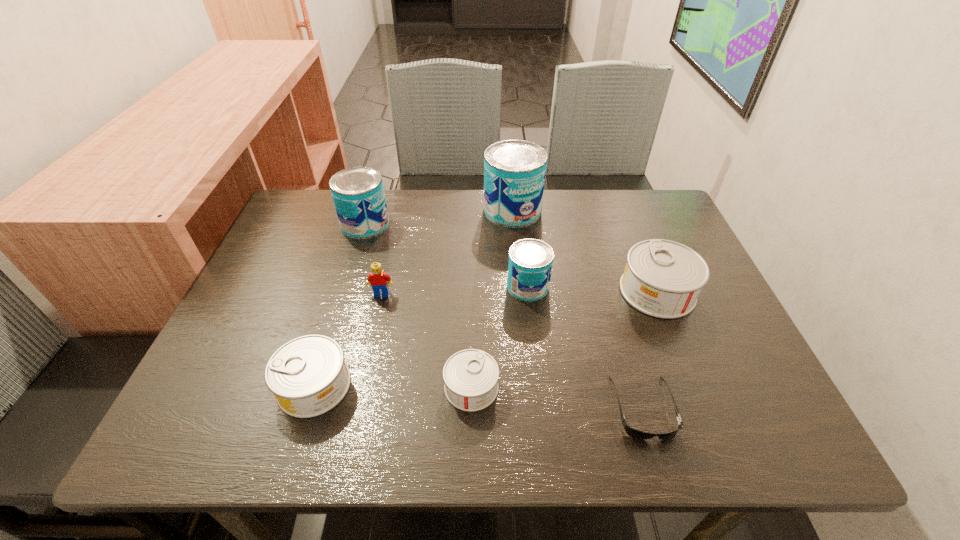
Where is `the tallest can`? The height and width of the screenshot is (540, 960). the tallest can is located at coordinates (514, 170).

This screenshot has height=540, width=960. In order to click on the biggest blue can in this screenshot , I will do `click(514, 170)`.

The width and height of the screenshot is (960, 540). I want to click on the second biggest blue can, so coord(358,194).

The height and width of the screenshot is (540, 960). In order to click on the second tallest object in this screenshot , I will do `click(358, 194)`.

Locate an element on the screen. the nearest blue can is located at coordinates (530, 261).

You are a GUI agent. You are given a task and a screenshot of the screen. Output one action in this format:
    pyautogui.click(x=<x>, y=<y>)
    Task: Click on the red Lego
    Image resolution: width=960 pixels, height=540 pixels.
    Given the screenshot: What is the action you would take?
    pyautogui.click(x=379, y=280)

Where is `the biggest silver can`? the biggest silver can is located at coordinates (663, 279).

Locate an element on the screen. The width and height of the screenshot is (960, 540). the farthest silver can is located at coordinates (663, 279).

Where is `the second shortest can`? Image resolution: width=960 pixels, height=540 pixels. the second shortest can is located at coordinates (308, 376).

At what (x,y) coordinates should I click in order to perform the action: click on the third shortest object. Please return your answer as a coordinate pair (x, y). The image size is (960, 540). Looking at the image, I should click on (308, 376).